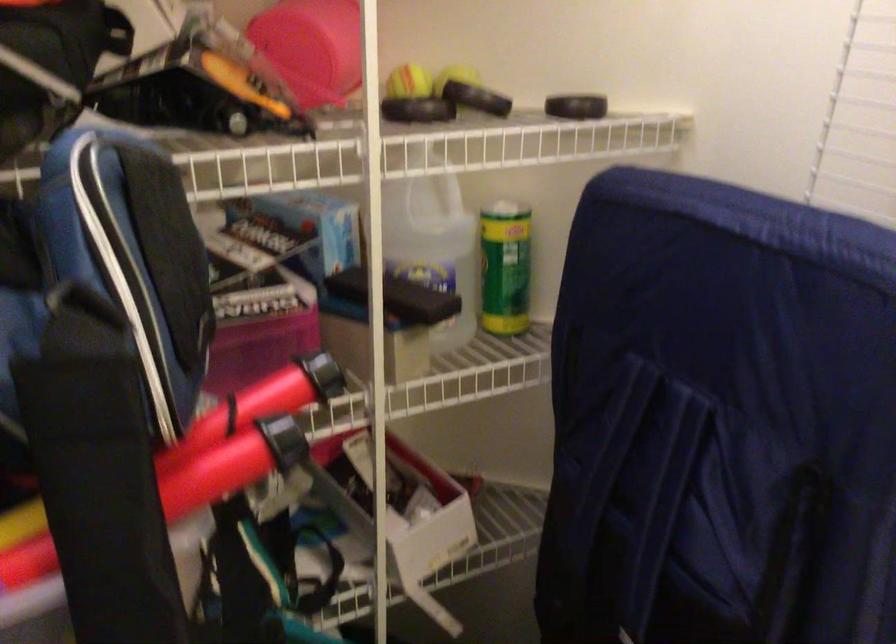
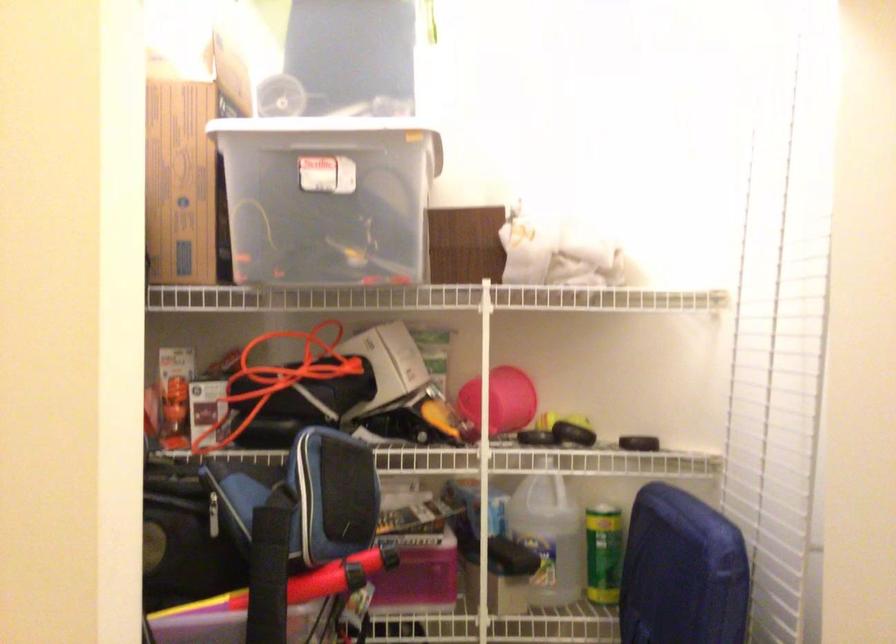
Where in the second image is the point corresponding to point 116,504 from the first image?

(269, 574)